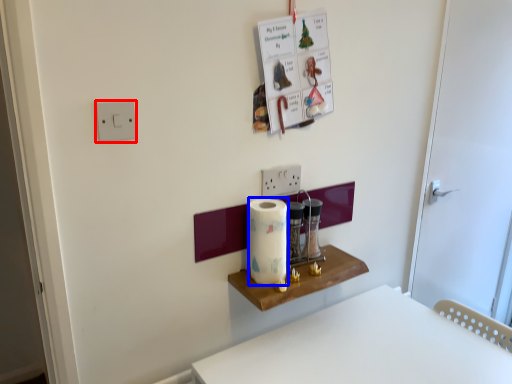
Question: Which of the following is the closest to the observer, light switch (highlighted by a red box) or paper towel (highlighted by a blue box)?

Choices:
 (A) light switch
 (B) paper towel

Answer: (A)